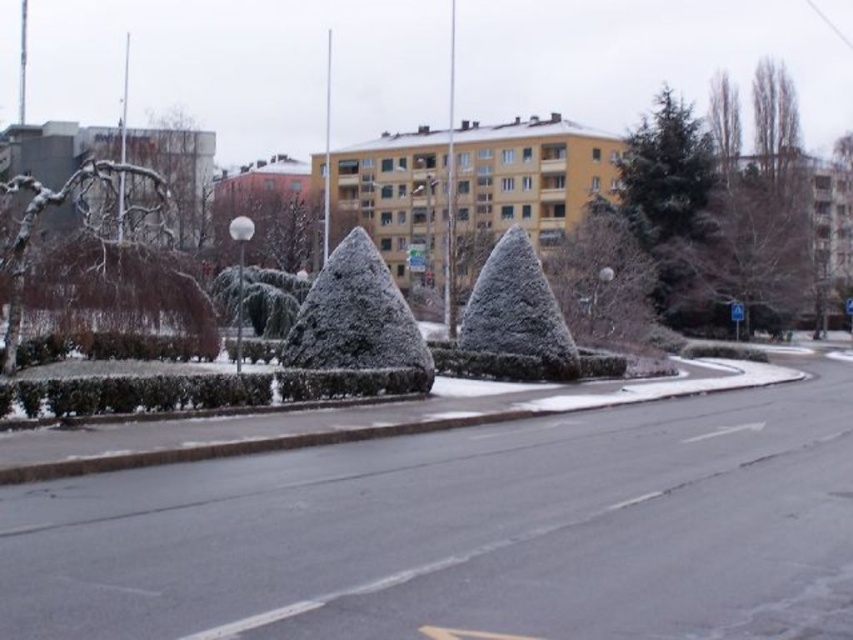
Which is above, snow-covered bush at center or snow-covered branches at left?

snow-covered branches at left

Is snow-covered bush at center taller than snow-covered branches at left?

In fact, snow-covered bush at center may be shorter than snow-covered branches at left.

Where is `snow-covered bush at center`? This screenshot has width=853, height=640. snow-covered bush at center is located at coordinates (357, 320).

Does white snow-covered bush at center appear on the right side of snow-covered branches at left?

Correct, you'll find white snow-covered bush at center to the right of snow-covered branches at left.

Who is more forward, (492, 344) or (16, 344)?

Positioned in front is point (16, 344).

Where is `white snow-covered bush at center`? The height and width of the screenshot is (640, 853). white snow-covered bush at center is located at coordinates (517, 314).

Measure the distance between white snow-covered bush at center and camera.

white snow-covered bush at center and camera are 24.86 meters apart.

Is white snow-covered bush at center thinner than green frosted bush at center?

Yes.

Is point (511, 248) less distant than point (262, 300)?

Yes, point (511, 248) is in front of point (262, 300).

In order to click on white snow-covered bush at center in this screenshot , I will do `click(517, 314)`.